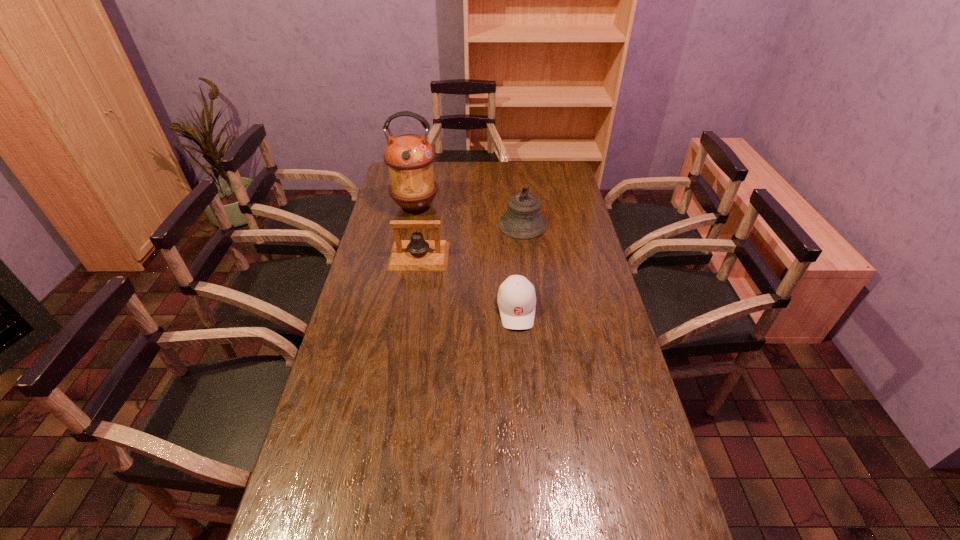
You are a GUI agent. You are given a task and a screenshot of the screen. Output one action in this format:
    pyautogui.click(x=<x>, y=<y>)
    Task: Click on the oil lamp
    The image size is (960, 540).
    Given the screenshot: What is the action you would take?
    pyautogui.click(x=409, y=157)

The image size is (960, 540). What are the coordinates of `the taller bell` in the screenshot? It's located at (523, 220).

This screenshot has height=540, width=960. Find the location of `the right bell`. the right bell is located at coordinates (523, 220).

Where is `the third farthest object`? the third farthest object is located at coordinates (417, 254).

Where is `the left bell`? This screenshot has width=960, height=540. the left bell is located at coordinates (417, 254).

Where is `the shortest object`? The height and width of the screenshot is (540, 960). the shortest object is located at coordinates (516, 298).

Locate an element on the screen. This screenshot has width=960, height=540. baseball cap is located at coordinates (516, 298).

The image size is (960, 540). Identify the location of vacant space located 0.050m on the front of the tallest object. (411, 226).

The height and width of the screenshot is (540, 960). I want to click on free space located 0.380m on the front of the third shortest object, so click(533, 308).

The image size is (960, 540). I want to click on vacant region located on the front of the second shortest object, so click(412, 303).